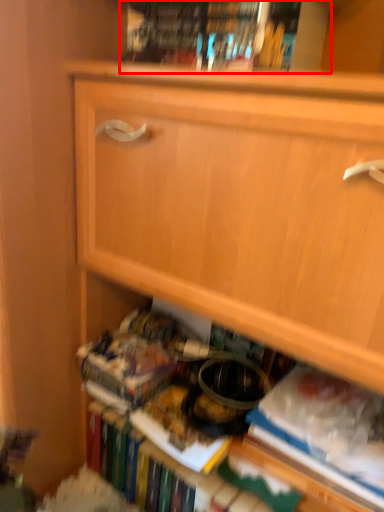
Question: Considering the relative positions of book (annotated by the red box) and paperback book in the image provided, where is book (annotated by the red box) located with respect to the staircase?

Choices:
 (A) left
 (B) right

Answer: (A)